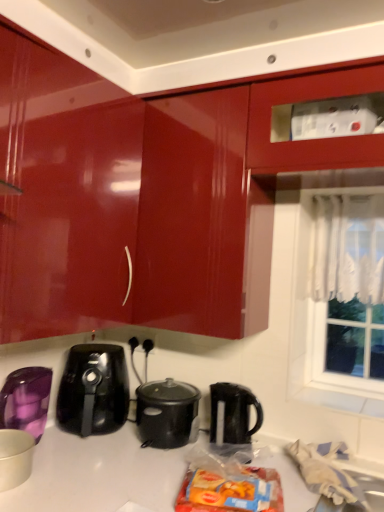
Locate an element on the screen. white lace curtain at upper right is located at coordinates (338, 288).

The height and width of the screenshot is (512, 384). I want to click on black matte slow cooker at center, so click(x=167, y=413).

The image size is (384, 512). Describe the element at coordinates (26, 400) in the screenshot. I see `purple glossy cup at lower left, positioned as the first kitchen appliance in back-to-front order` at that location.

Image resolution: width=384 pixels, height=512 pixels. I want to click on purple glossy cup at lower left, placed as the 2th kitchen appliance when sorted from front to back, so click(x=26, y=400).

The image size is (384, 512). Describe the element at coordinates (93, 390) in the screenshot. I see `black glossy air fryer at lower center` at that location.

At what (x,y) coordinates should I click in order to perform the action: click on matte white bowl at lower left, positioned as the second kitchen appliance in back-to-front order. Please return your answer as a coordinate pair (x, y). Image resolution: width=384 pixels, height=512 pixels. Looking at the image, I should click on (15, 457).

Where is `glossy red cabinet at upper center`? The width and height of the screenshot is (384, 512). glossy red cabinet at upper center is located at coordinates (147, 194).

Where is `kitchen appliance that is the 1st one below the black glossy air fryer at lower center (from a real-world perspective)`? kitchen appliance that is the 1st one below the black glossy air fryer at lower center (from a real-world perspective) is located at coordinates (26, 400).

Does purple glossy cup at lower left, positioned as the first kitchen appliance in back-to-front order, turn towards black glossy air fryer at lower center?

No, purple glossy cup at lower left, positioned as the first kitchen appliance in back-to-front order, is not oriented towards black glossy air fryer at lower center.

Is purple glossy cup at lower left, positioned as the first kitchen appliance in back-to-front order, to the left of black glossy air fryer at lower center from the viewer's perspective?

Correct, you'll find purple glossy cup at lower left, positioned as the first kitchen appliance in back-to-front order, to the left of black glossy air fryer at lower center.

From a real-world perspective, is purple glossy cup at lower left, positioned as the first kitchen appliance in back-to-front order, physically located above or below black glossy air fryer at lower center?

purple glossy cup at lower left, positioned as the first kitchen appliance in back-to-front order, is situated lower than black glossy air fryer at lower center in the real world.

From the image's perspective, is black plastic kettle at center located above or below white lace curtain at right?

From the image's perspective, black plastic kettle at center appears below white lace curtain at right.

From a real-world perspective, which is physically below, black plastic kettle at center or white lace curtain at right?

black plastic kettle at center.

From the picture: Is black plastic kettle at center beside white lace curtain at right?

No, black plastic kettle at center is not with white lace curtain at right.

Where is `home appliance behind the purple glossy cup at lower left, placed as the 2th kitchen appliance when sorted from front to back`? The image size is (384, 512). home appliance behind the purple glossy cup at lower left, placed as the 2th kitchen appliance when sorted from front to back is located at coordinates (93, 390).

Between black glossy air fryer at lower center and purple glossy cup at lower left, placed as the 2th kitchen appliance when sorted from front to back, which one appears on the right side from the viewer's perspective?

Positioned to the right is black glossy air fryer at lower center.

From the image's perspective, who appears lower, black glossy air fryer at lower center or purple glossy cup at lower left, placed as the 2th kitchen appliance when sorted from front to back?

purple glossy cup at lower left, placed as the 2th kitchen appliance when sorted from front to back, appears lower in the image.

Is point (239, 439) less distant than point (152, 386)?

Yes, point (239, 439) is closer to viewer.

The image size is (384, 512). I want to click on slow cooker on the left of black plastic kettle at center, so click(x=167, y=413).

Considering the relative sizes of black plastic kettle at center and black matte slow cooker at center in the image provided, is black plastic kettle at center taller than black matte slow cooker at center?

Yes, black plastic kettle at center is taller than black matte slow cooker at center.

Which of these two, purple glossy cup at lower left, positioned as the first kitchen appliance in back-to-front order, or white lace curtain at upper right, stands taller?

white lace curtain at upper right.

Is purple glossy cup at lower left, positioned as the first kitchen appliance in back-to-front order, looking in the opposite direction of white lace curtain at upper right?

purple glossy cup at lower left, positioned as the first kitchen appliance in back-to-front order, does not have its back to white lace curtain at upper right.

Does purple glossy cup at lower left, placed as the 2th kitchen appliance when sorted from front to back, touch white lace curtain at upper right?

No, purple glossy cup at lower left, placed as the 2th kitchen appliance when sorted from front to back, is not making contact with white lace curtain at upper right.

Considering the positions of point (14, 380) and point (300, 238), is point (14, 380) closer or farther from the camera than point (300, 238)?

Point (14, 380) is closer to the camera than point (300, 238).

Is white lace curtain at upper right facing towards glossy red cabinet at upper center?

Yes, white lace curtain at upper right faces towards glossy red cabinet at upper center.

From the image's perspective, is white lace curtain at upper right located beneath glossy red cabinet at upper center?

Yes, from the image's perspective, white lace curtain at upper right is below glossy red cabinet at upper center.

Would you consider white lace curtain at upper right to be distant from glossy red cabinet at upper center?

No, white lace curtain at upper right is not far from glossy red cabinet at upper center.

Does white lace curtain at upper right have a smaller size compared to glossy red cabinet at upper center?

Yes.

From the image's perspective, which is below, glossy red cabinet at upper center or black matte slow cooker at center?

black matte slow cooker at center.

Between glossy red cabinet at upper center and black matte slow cooker at center, which one has more height?

Standing taller between the two is glossy red cabinet at upper center.

Is glossy red cabinet at upper center wider or thinner than black matte slow cooker at center?

Clearly, glossy red cabinet at upper center has more width compared to black matte slow cooker at center.

Locate an element on the screen. home appliance on the right side of purple glossy cup at lower left, positioned as the first kitchen appliance in back-to-front order is located at coordinates (93, 390).

Locate an element on the screen. kettle located in front of the white lace curtain at right is located at coordinates (232, 418).

Which object lies nearer to the anchor point glossy red cabinet at upper center, white lace curtain at upper right or matte white bowl at lower left, positioned as the 1th kitchen appliance in front-to-back order?

white lace curtain at upper right lies closer to glossy red cabinet at upper center than the other object.

Estimate the real-world distances between objects in this image. Which object is closer to black matte slow cooker at center, black glossy air fryer at lower center or black plastic kettle at center?

black plastic kettle at center is closer to black matte slow cooker at center.

Estimate the real-world distances between objects in this image. Which object is closer to white lace curtain at right, black plastic kettle at center or glossy red cabinet at upper center?

Based on the image, glossy red cabinet at upper center appears to be nearer to white lace curtain at right.

Estimate the real-world distances between objects in this image. Which object is further from matte white bowl at lower left, positioned as the 1th kitchen appliance in front-to-back order, black matte slow cooker at center or glossy red cabinet at upper center?

glossy red cabinet at upper center lies further to matte white bowl at lower left, positioned as the 1th kitchen appliance in front-to-back order, than the other object.

Estimate the real-world distances between objects in this image. Which object is further from purple glossy cup at lower left, positioned as the first kitchen appliance in back-to-front order, white lace curtain at upper right or matte white bowl at lower left, positioned as the 1th kitchen appliance in front-to-back order?

The object further to purple glossy cup at lower left, positioned as the first kitchen appliance in back-to-front order, is white lace curtain at upper right.

From the image, which object appears to be nearer to matte white bowl at lower left, positioned as the second kitchen appliance in back-to-front order, white lace curtain at right or white lace curtain at upper right?

white lace curtain at upper right is closer to matte white bowl at lower left, positioned as the second kitchen appliance in back-to-front order.

When comparing their distances from black matte slow cooker at center, does glossy red cabinet at upper center or white lace curtain at right seem closer?

glossy red cabinet at upper center lies closer to black matte slow cooker at center than the other object.

From the image, which object appears to be farther from black matte slow cooker at center, black plastic kettle at center or black glossy air fryer at lower center?

The object further to black matte slow cooker at center is black glossy air fryer at lower center.

Find the location of a particular element. The image size is (384, 512). curtain between glossy red cabinet at upper center and black plastic kettle at center vertically is located at coordinates (348, 248).

Where is `cabinetry situated between purple glossy cup at lower left, placed as the 2th kitchen appliance when sorted from front to back, and white lace curtain at upper right from left to right`? This screenshot has width=384, height=512. cabinetry situated between purple glossy cup at lower left, placed as the 2th kitchen appliance when sorted from front to back, and white lace curtain at upper right from left to right is located at coordinates coord(147,194).

This screenshot has height=512, width=384. Identify the location of home appliance located between matte white bowl at lower left, positioned as the 1th kitchen appliance in front-to-back order, and white lace curtain at right in the left-right direction. 93,390.

The image size is (384, 512). Find the location of `slow cooker between black glossy air fryer at lower center and white lace curtain at right from left to right`. slow cooker between black glossy air fryer at lower center and white lace curtain at right from left to right is located at coordinates (167, 413).